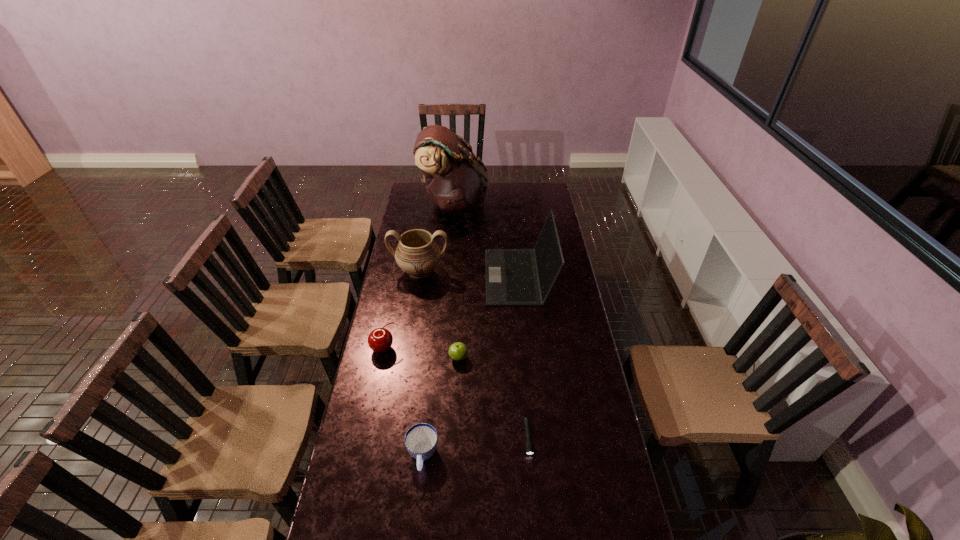
Find the location of a particular element. The width and height of the screenshot is (960, 540). vacant space located 0.320m on the screen of the laptop is located at coordinates (418, 276).

Identify the location of vacant space located on the screen of the laptop. Image resolution: width=960 pixels, height=540 pixels. (456, 276).

The width and height of the screenshot is (960, 540). I want to click on free region located on the front-facing side of the urn, so click(x=411, y=328).

In order to click on free region located 0.200m on the front of the cherry in this screenshot , I will do `click(372, 403)`.

The width and height of the screenshot is (960, 540). In order to click on vacant position located on the left of the apple in this screenshot , I will do `click(369, 357)`.

Where is `free spot located on the side of the cup with the handle`? free spot located on the side of the cup with the handle is located at coordinates (417, 514).

This screenshot has width=960, height=540. I want to click on vacant space positioned at the lens end of the flashlight, so click(532, 485).

The image size is (960, 540). Find the location of `object located in the far edge section of the desktop`. object located in the far edge section of the desktop is located at coordinates (456, 180).

The image size is (960, 540). Find the location of `satchel that is at the left edge`. satchel that is at the left edge is located at coordinates (456, 180).

I want to click on urn located in the left edge section of the desktop, so click(x=417, y=254).